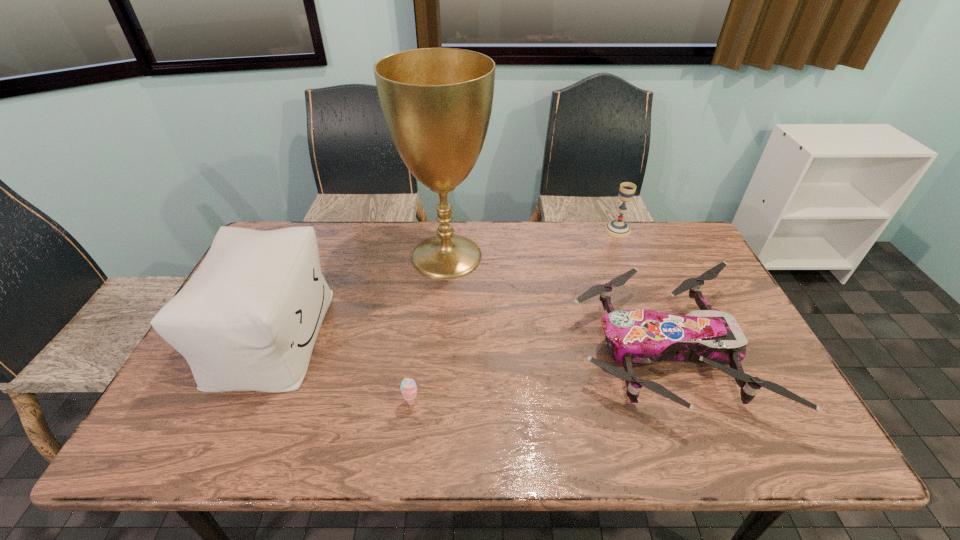
The image size is (960, 540). What are the coordinates of `object at the far right corner` in the screenshot? It's located at (685, 172).

The width and height of the screenshot is (960, 540). In the image, there is a desktop. What are the coordinates of `vacant space at the far edge` in the screenshot? It's located at (422, 219).

Where is `vacant space at the near edge`? The image size is (960, 540). vacant space at the near edge is located at coordinates (615, 430).

Find the location of a particular element. The image size is (960, 540). free space at the left edge of the desktop is located at coordinates (230, 305).

I want to click on free spot between the rightmost white detergent and the tallest object, so click(613, 217).

Identify the location of empty space that is in between the third detergent from left to right and the blue pottery. The height and width of the screenshot is (540, 960). (364, 361).

Locate an element on the screen. The height and width of the screenshot is (540, 960). free area in between the second biggest white detergent and the fifth detergent from right to left is located at coordinates (338, 251).

Locate an element on the screen. This screenshot has width=960, height=540. vacant space that's between the bigger blue detergent and the leftmost detergent is located at coordinates (338, 251).

You are a GUI agent. You are given a task and a screenshot of the screen. Output one action in this format:
    pyautogui.click(x=<x>, y=<y>)
    Task: Click on the free space that is in between the radio receiver and the left blue detergent
    
    Given the screenshot: What is the action you would take?
    pyautogui.click(x=559, y=275)

The height and width of the screenshot is (540, 960). Identify the location of free space between the biggest white detergent and the radio receiver. (640, 265).